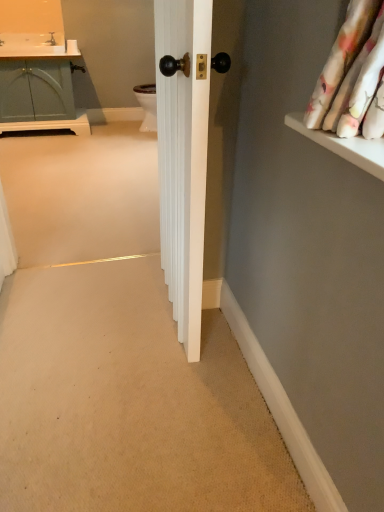
The width and height of the screenshot is (384, 512). What do you see at coordinates (280, 406) in the screenshot?
I see `white smooth baseboard at lower right` at bounding box center [280, 406].

What are the coordinates of `white smooth baseboard at lower right` in the screenshot? It's located at (280, 406).

This screenshot has height=512, width=384. I want to click on white smooth baseboard at lower right, so click(280, 406).